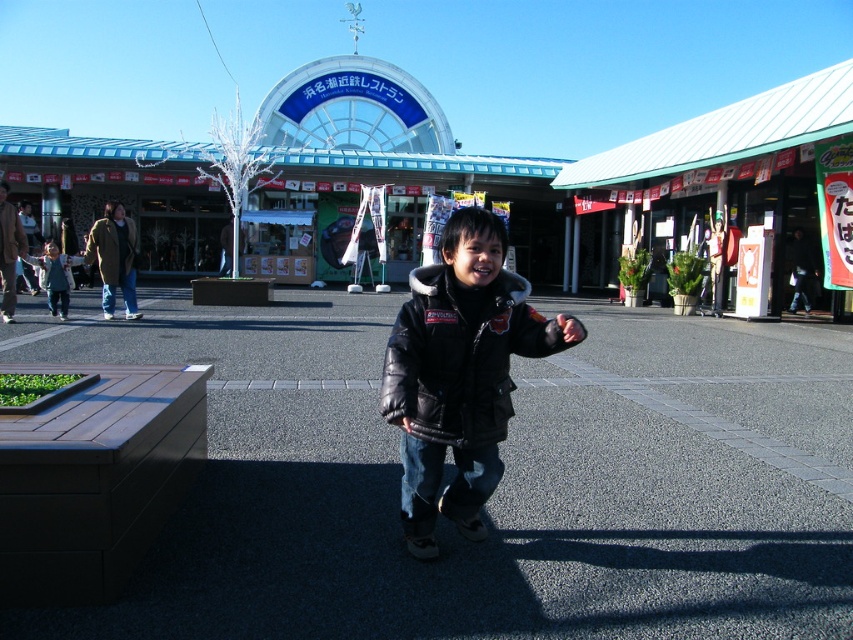
Identify the location of blue glass building at center. (596, 61).

This screenshot has width=853, height=640. In order to click on blue glass building at center in this screenshot , I will do `click(596, 61)`.

This screenshot has width=853, height=640. Identify the location of blue glass building at center. (596, 61).

This screenshot has width=853, height=640. What do you see at coordinates (498, 484) in the screenshot?
I see `dark gray asphalt at center` at bounding box center [498, 484].

The height and width of the screenshot is (640, 853). In order to click on dark gray asphalt at center in this screenshot , I will do `click(498, 484)`.

Is black leather jacket at center closer to the viewer compared to matte black jacket at center?

Yes, it is in front of matte black jacket at center.

Locate an element on the screen. black leather jacket at center is located at coordinates [x=462, y=355].